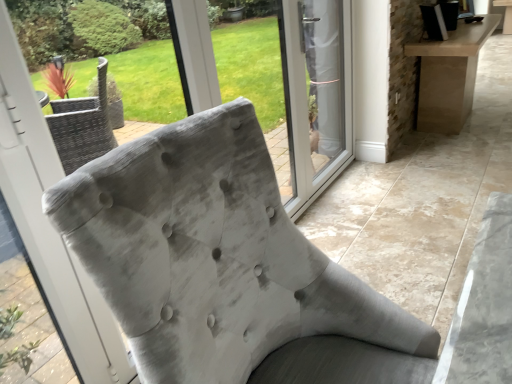
Where is `transparent glass door at center`? The width and height of the screenshot is (512, 384). transparent glass door at center is located at coordinates (316, 94).

This screenshot has width=512, height=384. Describe the element at coordinates (316, 94) in the screenshot. I see `transparent glass door at center` at that location.

Image resolution: width=512 pixels, height=384 pixels. Describe the element at coordinates (212, 254) in the screenshot. I see `velvet gray chair at center` at that location.

What is the approximate height of velvet gray chair at center?

It is 3.35 feet.

At what (x,y) coordinates should I click in order to perform the action: click on velvet gray chair at center. Please return your answer as a coordinate pair (x, y). Looking at the image, I should click on (212, 254).

Where is `transparent glass door at center`? transparent glass door at center is located at coordinates (316, 94).

Which is more to the right, transparent glass door at center or velvet gray chair at center?

From the viewer's perspective, transparent glass door at center appears more on the right side.

Considering the positions of objects transparent glass door at center and velvet gray chair at center in the image provided, who is behind, transparent glass door at center or velvet gray chair at center?

transparent glass door at center is more distant.

Does point (316, 21) lie in front of point (111, 180)?

No.

From the picture: From the image's perspective, is transparent glass door at center above or below velvet gray chair at center?

transparent glass door at center is situated higher than velvet gray chair at center in the image.

From a real-world perspective, is transparent glass door at center positioned over velvet gray chair at center based on gravity?

Yes.

Is transparent glass door at center wider or thinner than velvet gray chair at center?

In the image, transparent glass door at center appears to be more narrow than velvet gray chair at center.

Which of these two, transparent glass door at center or velvet gray chair at center, stands taller?

With more height is transparent glass door at center.

Does transparent glass door at center have a larger size compared to velvet gray chair at center?

No.

Is transparent glass door at center situated inside velvet gray chair at center or outside?

transparent glass door at center is not enclosed by velvet gray chair at center.

Would you consider transparent glass door at center to be distant from velvet gray chair at center?

→ Yes, transparent glass door at center and velvet gray chair at center are quite far apart.

Is transparent glass door at center turned away from velvet gray chair at center?

No, velvet gray chair at center is not at the back of transparent glass door at center.

Measure the distance between transparent glass door at center and velvet gray chair at center.

They are 5.41 feet apart.

Find the location of a particular element. Image resolution: width=512 pixels, height=384 pixels. chair located below the transparent glass door at center (from the image's perspective) is located at coordinates (212, 254).

Between velvet gray chair at center and transparent glass door at center, which one appears on the right side from the viewer's perspective?

transparent glass door at center.

Considering the relative positions of velvet gray chair at center and transparent glass door at center in the image provided, is velvet gray chair at center in front of transparent glass door at center?

Yes, velvet gray chair at center is closer to the viewer.

Which is closer, (228,151) or (331,62)?

The point (228,151) is in front.

From the image's perspective, does velvet gray chair at center appear lower than transparent glass door at center?

Yes, from the image's perspective, velvet gray chair at center is below transparent glass door at center.

From a real-world perspective, relative to transparent glass door at center, is velvet gray chair at center vertically above or below?

In terms of real-world spatial position, velvet gray chair at center is below transparent glass door at center.

Which of these two, velvet gray chair at center or transparent glass door at center, is wider?

velvet gray chair at center.

Who is taller, velvet gray chair at center or transparent glass door at center?

Standing taller between the two is transparent glass door at center.

In terms of size, does velvet gray chair at center appear bigger or smaller than transparent glass door at center?

velvet gray chair at center is bigger than transparent glass door at center.

Looking at this image, is velvet gray chair at center situated inside transparent glass door at center or outside?

velvet gray chair at center exists outside the volume of transparent glass door at center.

Does velvet gray chair at center touch transparent glass door at center?

velvet gray chair at center and transparent glass door at center are clearly separated.

Could you tell me if velvet gray chair at center is facing transparent glass door at center?

No, velvet gray chair at center is not facing towards transparent glass door at center.

Can you tell me how much velvet gray chair at center and transparent glass door at center differ in facing direction?

0.0045 degrees.

Find the location of a particular element. chair that is under the transparent glass door at center (from a real-world perspective) is located at coordinates (212, 254).

Identify the location of chair lying in front of the transparent glass door at center. (212, 254).

The image size is (512, 384). In the image, there is a transparent glass door at center. In order to click on chair below it (from a real-world perspective) in this screenshot , I will do `click(212, 254)`.